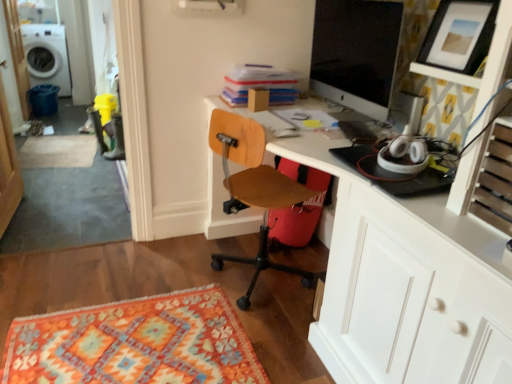
Question: Can you confirm if white glossy washing machine at upper left is positioned to the right of woodenchair at center?

Choices:
 (A) yes
 (B) no

Answer: (B)

Question: Considering the relative sizes of white glossy washing machine at upper left and woodenchair at center in the image provided, is white glossy washing machine at upper left shorter than woodenchair at center?

Choices:
 (A) yes
 (B) no

Answer: (A)

Question: From a real-world perspective, is white glossy washing machine at upper left located beneath woodenchair at center?

Choices:
 (A) yes
 (B) no

Answer: (A)

Question: From a real-world perspective, does white glossy washing machine at upper left stand above woodenchair at center?

Choices:
 (A) yes
 (B) no

Answer: (B)

Question: Can you confirm if white glossy washing machine at upper left is wider than woodenchair at center?

Choices:
 (A) no
 (B) yes

Answer: (B)

Question: Considering the positions of matte black picture frame at upper right and white glossy desk at upper center in the image, is matte black picture frame at upper right bigger or smaller than white glossy desk at upper center?

Choices:
 (A) big
 (B) small

Answer: (B)

Question: Is matte black picture frame at upper right spatially inside white glossy desk at upper center, or outside of it?

Choices:
 (A) outside
 (B) inside

Answer: (B)

Question: Is point (x=435, y=33) positioned closer to the camera than point (x=420, y=327)?

Choices:
 (A) farther
 (B) closer

Answer: (A)

Question: Is matte black picture frame at upper right to the left or to the right of white glossy desk at upper center in the image?

Choices:
 (A) left
 (B) right

Answer: (B)

Question: Does point (381, 56) appear closer or farther from the camera than point (251, 195)?

Choices:
 (A) closer
 (B) farther

Answer: (A)

Question: Is matte black monitor at upper right to the left or to the right of woodenchair at center in the image?

Choices:
 (A) left
 (B) right

Answer: (B)

Question: Looking at their shapes, would you say matte black monitor at upper right is wider or thinner than woodenchair at center?

Choices:
 (A) wide
 (B) thin

Answer: (B)

Question: Is matte black monitor at upper right taller or shorter than woodenchair at center?

Choices:
 (A) short
 (B) tall

Answer: (A)

Question: Relative to white glossy washing machine at upper left, is beige carpet at lower left, acting as the second mat starting from the right, in front or behind?

Choices:
 (A) behind
 (B) front

Answer: (B)

Question: In the image, is beige carpet at lower left, which ranks as the first mat in back-to-front order, on the left side or the right side of white glossy washing machine at upper left?

Choices:
 (A) right
 (B) left

Answer: (A)